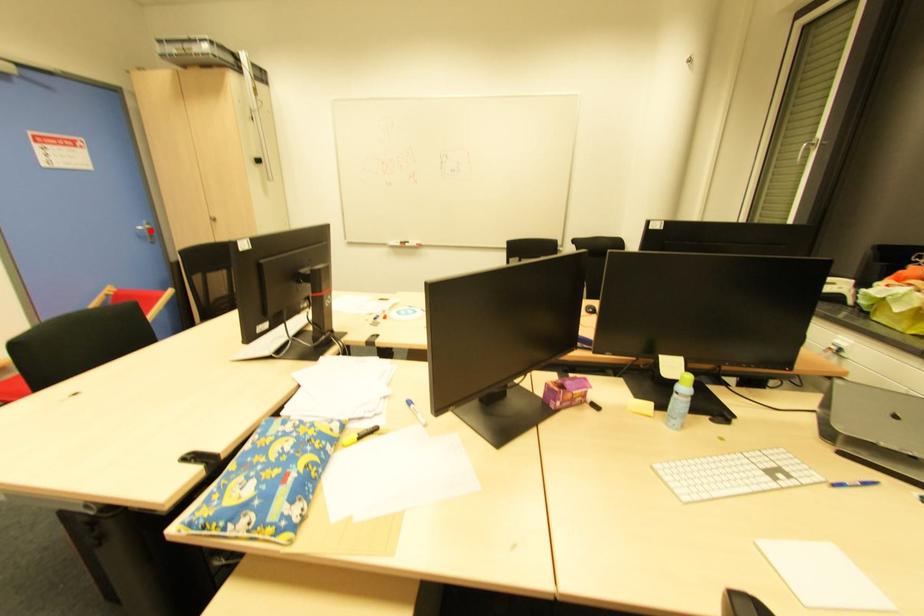
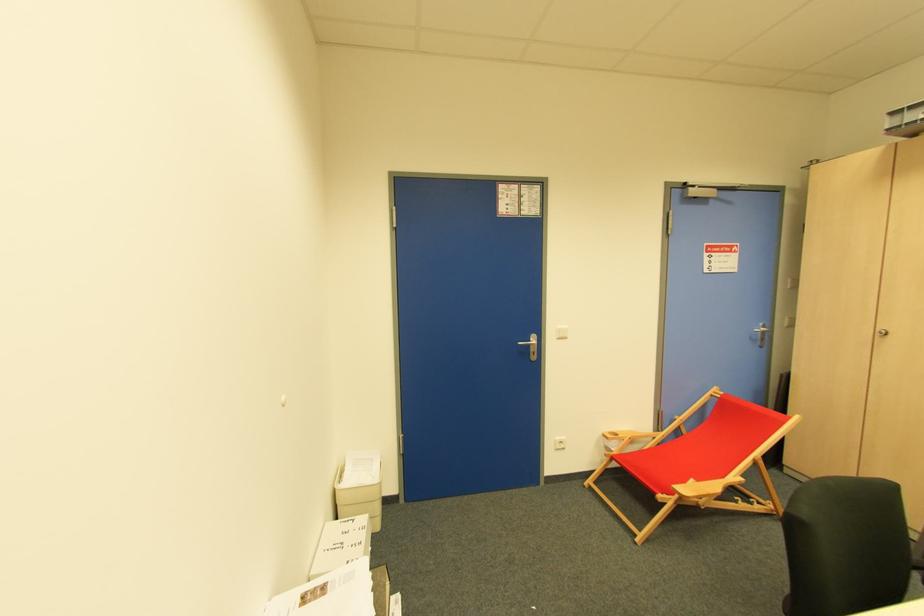
Where in the second image is the point corresponding to the highlighted location from the first image?

(763, 333)